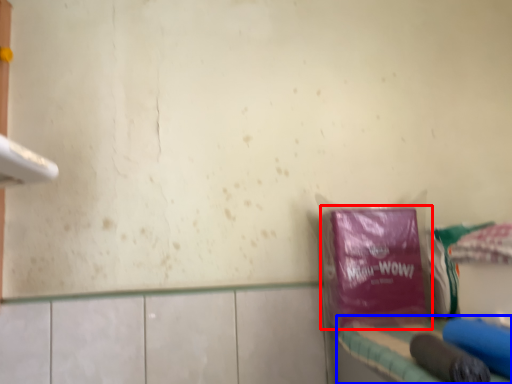
Question: Which object is further to the camera taking this photo, plastic bag (highlighted by a red box) or vanity (highlighted by a blue box)?

Choices:
 (A) plastic bag
 (B) vanity

Answer: (A)